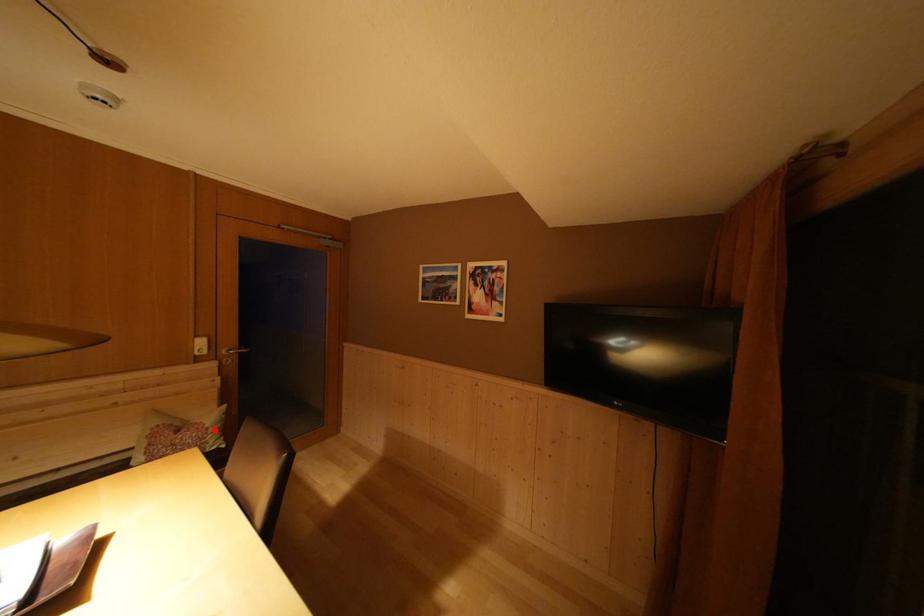
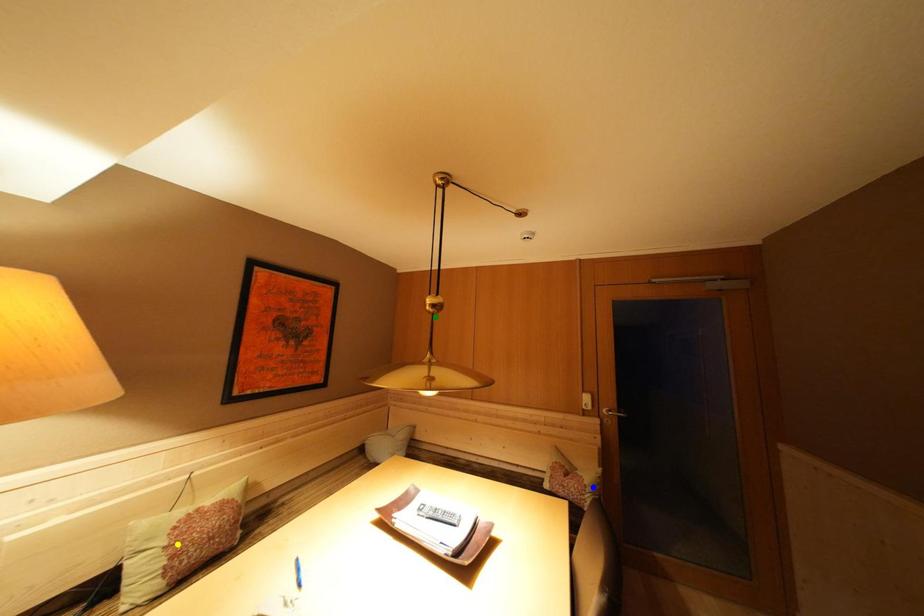
Question: I am providing you with two images of the same scene from different viewpoints. A red point is marked on the first image. You are given multiple points on the second image. Which mark in image 2 goes with the point in image 1?

Choices:
 (A) blue point
 (B) green point
 (C) yellow point

Answer: (A)